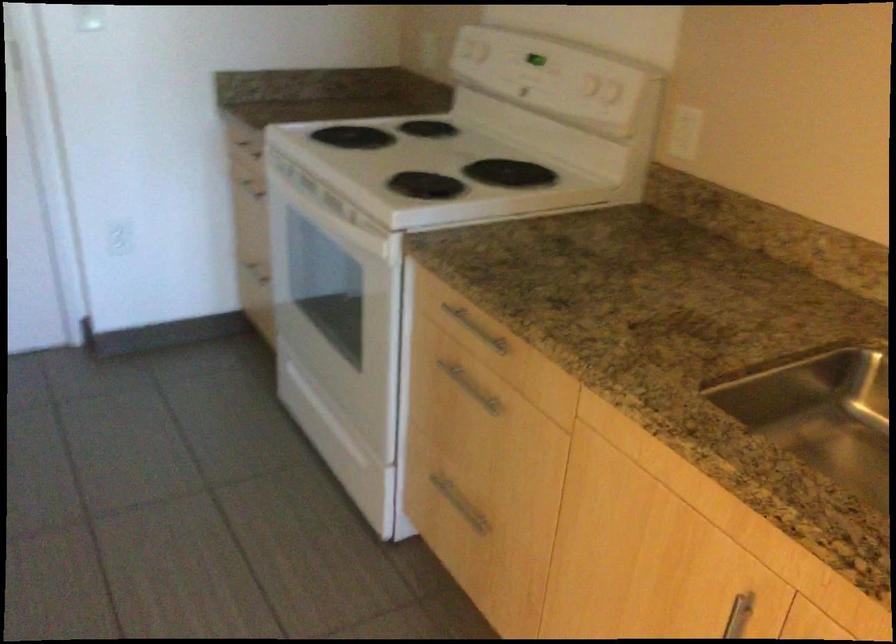
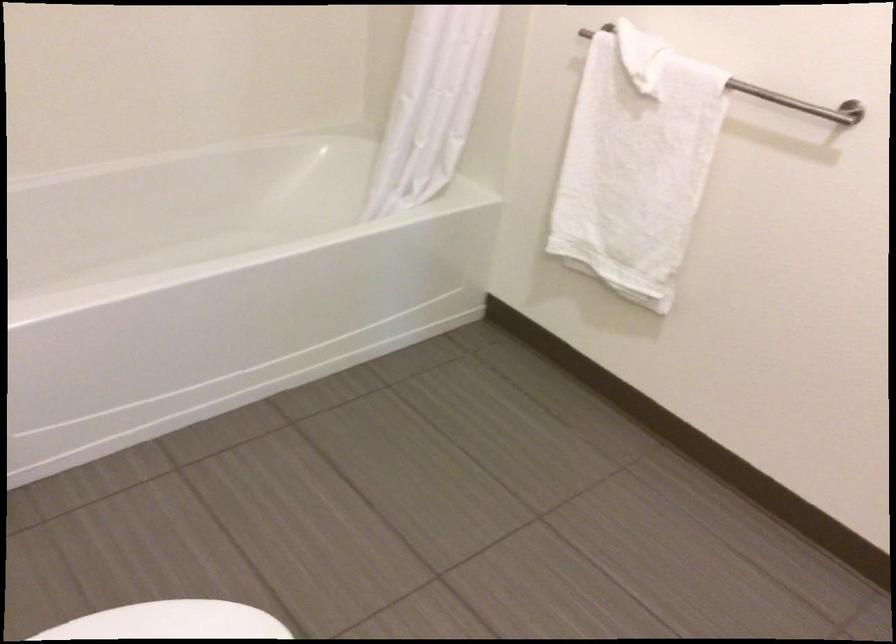
The images are taken continuously from a first-person perspective. In which direction are you moving?

The cameraman moved toward left, backward.